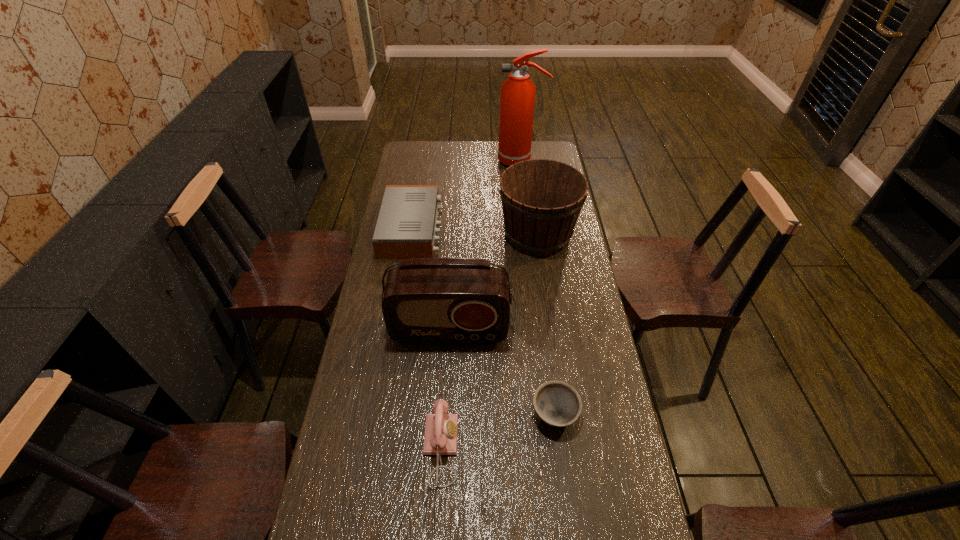
The height and width of the screenshot is (540, 960). I want to click on vacant region that satisfies the following two spatial constraints: 1. on the control panel of the second shortest object; 2. on the back side of the shortest object, so click(x=381, y=414).

Find the location of `vacant area in the image that satisfies the following two spatial constraints: 1. on the front side of the wine bucket; 2. on the dial of the fourth tallest object`. vacant area in the image that satisfies the following two spatial constraints: 1. on the front side of the wine bucket; 2. on the dial of the fourth tallest object is located at coordinates (567, 448).

Identify the location of free spot that satisfies the following two spatial constraints: 1. on the back side of the third tallest object; 2. on the control panel of the farther radio receiver. The image size is (960, 540). (537, 229).

Identify the location of vacant space that satisfies the following two spatial constraints: 1. on the front panel of the nearer radio receiver; 2. on the right side of the bowl. This screenshot has width=960, height=540. (444, 414).

Locate an element on the screen. free space in the image that satisfies the following two spatial constraints: 1. on the front panel of the taller radio receiver; 2. on the right side of the shortest object is located at coordinates (444, 414).